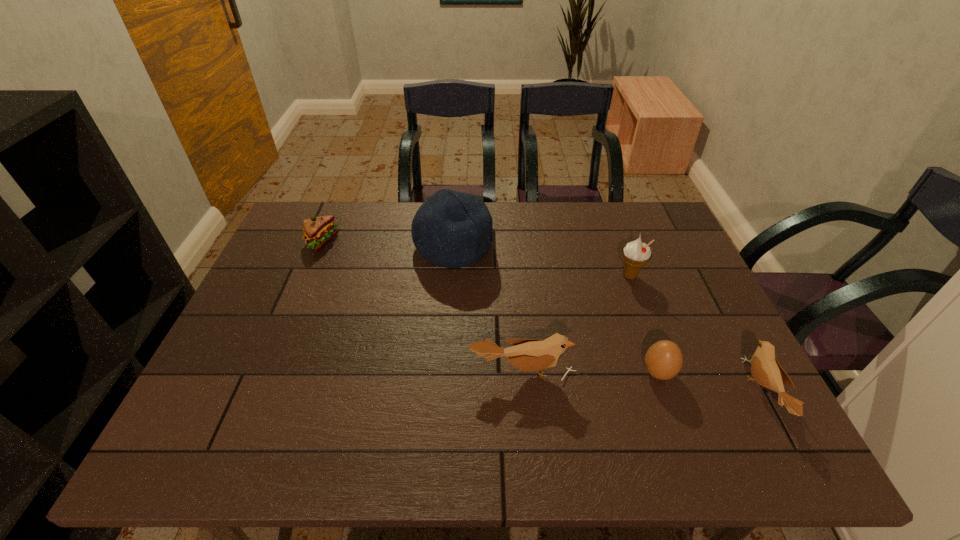
Find the location of a particular element. The image size is (960, 540). the fourth shortest object is located at coordinates (528, 355).

You are a GUI agent. You are given a task and a screenshot of the screen. Output one action in this format:
    pyautogui.click(x=<x>, y=<y>)
    Task: Click on the taller bird
    The image size is (960, 540).
    Given the screenshot: What is the action you would take?
    pyautogui.click(x=528, y=355)

Locate an element on the screen. the shorter bird is located at coordinates (765, 368).

The height and width of the screenshot is (540, 960). I want to click on the right bird, so click(x=765, y=368).

What are the coordinates of `icecream` in the screenshot? It's located at (635, 254).

Locate an element on the screen. the leftmost object is located at coordinates click(318, 231).

This screenshot has width=960, height=540. Find the location of `the tallest object`. the tallest object is located at coordinates (451, 229).

Locate an element on the screen. boiled egg is located at coordinates (663, 360).

Where is `vacant space located 0.170m on the back of the icecream`? The image size is (960, 540). vacant space located 0.170m on the back of the icecream is located at coordinates (613, 232).

At what (x,y) coordinates should I click in order to perform the action: click on vacant space located on the right of the leftmost object. Please return your answer as a coordinate pair (x, y). This screenshot has width=960, height=540. Looking at the image, I should click on (391, 242).